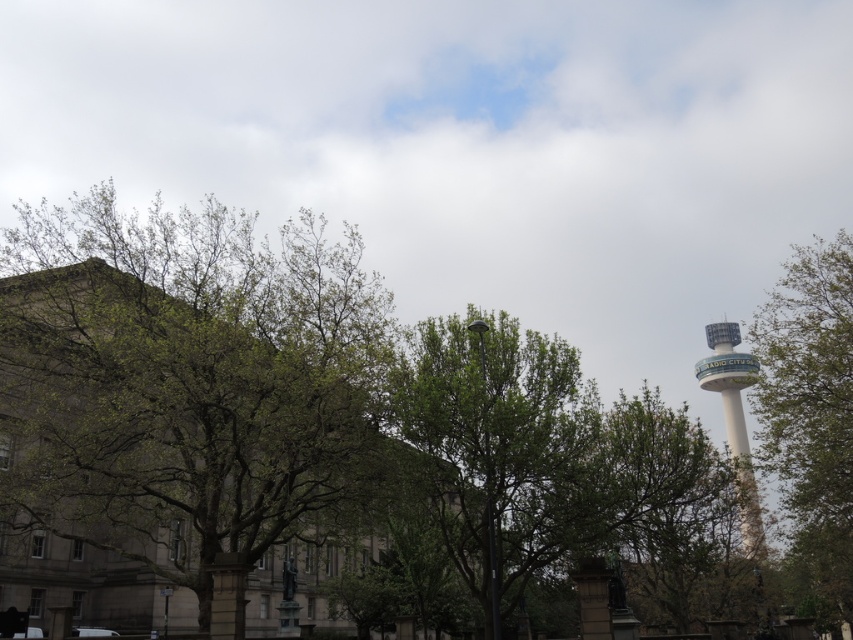
You are standing at the lamppost in the urban scene. You see two points marked in the image. Which point is closer to you? The points are labeled as point (637, 440) and point (711, 384). Please answer based on their positions in the scene.

Point (637, 440) is in front of point (711, 384), so it is closer to you.

Based on the scene description, where is the green leafy tree located? Please provide coordinates in the format of a point like point (538, 452).

The green leafy tree is located at point (538, 452).